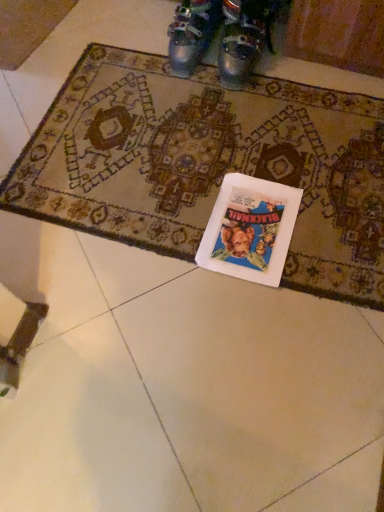
Question: From the image's perspective, is white paper book at center over metallic silver boots at upper center, the second footwear when ordered from right to left?

Choices:
 (A) no
 (B) yes

Answer: (A)

Question: From a real-world perspective, is white paper book at center located beneath metallic silver boots at upper center, the second footwear when ordered from right to left?

Choices:
 (A) no
 (B) yes

Answer: (B)

Question: Does white paper book at center have a larger size compared to metallic silver boots at upper center, the second footwear when ordered from right to left?

Choices:
 (A) yes
 (B) no

Answer: (B)

Question: Can we say white paper book at center lies outside metallic silver boots at upper center, which is counted as the first footwear, starting from the left?

Choices:
 (A) yes
 (B) no

Answer: (A)

Question: Can you confirm if white paper book at center is taller than metallic silver boots at upper center, which is counted as the first footwear, starting from the left?

Choices:
 (A) no
 (B) yes

Answer: (A)

Question: From a real-world perspective, relative to carpeted mat at center, is metallic silver shoes at upper center, which ranks as the second footwear in left-to-right order, vertically above or below?

Choices:
 (A) below
 (B) above

Answer: (B)

Question: Relative to carpeted mat at center, is metallic silver shoes at upper center, which ranks as the second footwear in left-to-right order, in front or behind?

Choices:
 (A) behind
 (B) front

Answer: (A)

Question: Is metallic silver shoes at upper center, which ranks as the second footwear in left-to-right order, wider or thinner than carpeted mat at center?

Choices:
 (A) wide
 (B) thin

Answer: (B)

Question: Based on their sizes in the image, would you say metallic silver shoes at upper center, which ranks as the second footwear in left-to-right order, is bigger or smaller than carpeted mat at center?

Choices:
 (A) small
 (B) big

Answer: (A)

Question: Considering the positions of carpeted mat at center and metallic silver boots at upper center, the second footwear when ordered from right to left, in the image, is carpeted mat at center bigger or smaller than metallic silver boots at upper center, the second footwear when ordered from right to left,?

Choices:
 (A) small
 (B) big

Answer: (B)

Question: From the image's perspective, is carpeted mat at center positioned above or below metallic silver boots at upper center, the second footwear when ordered from right to left?

Choices:
 (A) below
 (B) above

Answer: (A)

Question: Is carpeted mat at center spatially inside metallic silver boots at upper center, the second footwear when ordered from right to left, or outside of it?

Choices:
 (A) inside
 (B) outside

Answer: (B)

Question: Is point (309, 93) closer or farther from the camera than point (205, 3)?

Choices:
 (A) farther
 (B) closer

Answer: (A)

Question: From the image's perspective, is white paper book at center positioned above or below metallic silver boots at upper center, which is counted as the first footwear, starting from the left?

Choices:
 (A) above
 (B) below

Answer: (B)

Question: Looking at their shapes, would you say white paper book at center is wider or thinner than metallic silver boots at upper center, which is counted as the first footwear, starting from the left?

Choices:
 (A) thin
 (B) wide

Answer: (B)